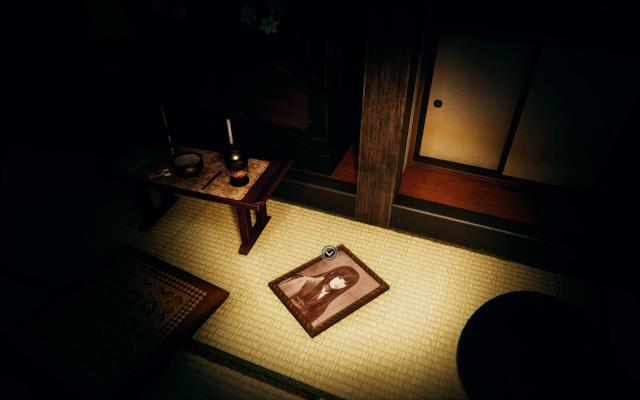
The image size is (640, 400). What are the coordinates of `right table legs` in the screenshot? It's located at (244, 236).